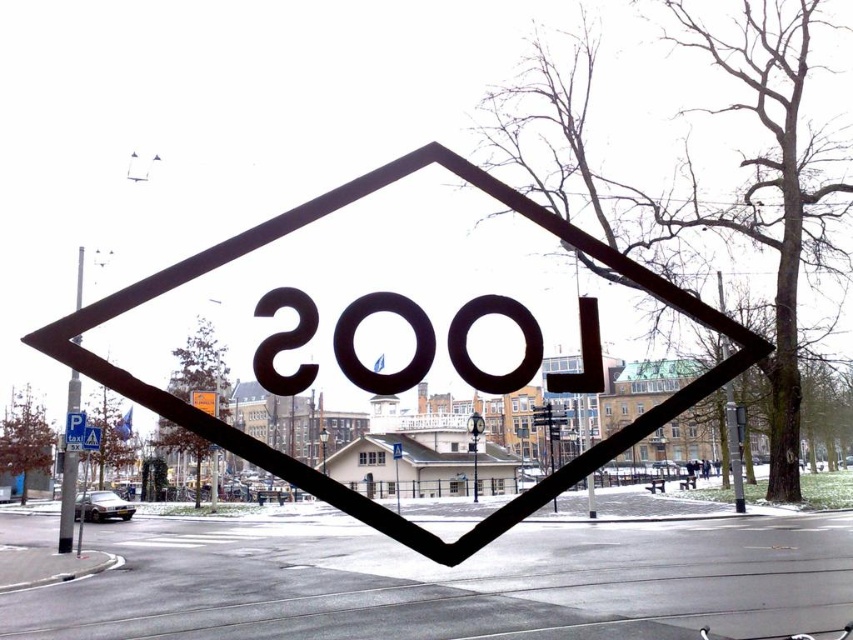
Question: Which object appears farthest from the camera in this image?

Choices:
 (A) black metal sign at center
 (B) black matte sign at center
 (C) metallic pole at left
 (D) black matte number at center

Answer: (A)

Question: Which point is farther to the camera?

Choices:
 (A) (347, 328)
 (B) (91, 428)
 (C) (73, 339)
 (D) (247, 456)

Answer: (B)

Question: Which of the following is the farthest from the observer?

Choices:
 (A) black metal sign at center
 (B) metallic sign at center
 (C) black matte number at center
 (D) metallic pole at left

Answer: (A)

Question: Does metallic sign at center appear under black metal sign at center?

Choices:
 (A) yes
 (B) no

Answer: (B)

Question: Where is metallic pole at left located in relation to black metal sign at center in the image?

Choices:
 (A) below
 (B) above

Answer: (B)

Question: Can you confirm if black matte number at center is positioned to the left of black matte sign at center?

Choices:
 (A) no
 (B) yes

Answer: (A)